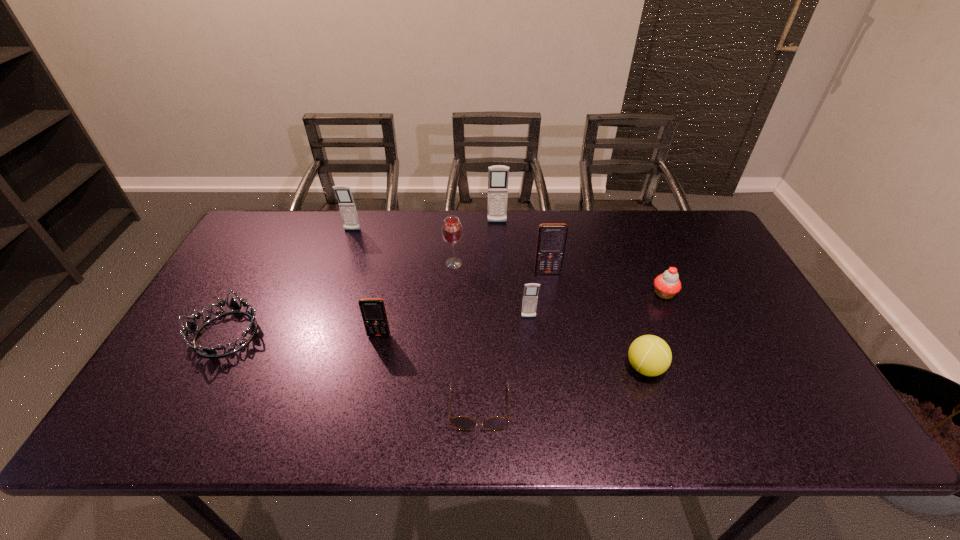
At what (x,y) coordinates should I click in order to perform the action: click on free space located 0.080m on the front-facing side of the second farthest object. Please return your answer as a coordinate pair (x, y). Looking at the image, I should click on (347, 248).

I want to click on free space located on the screen of the third nearest cellular telephone, so click(x=564, y=373).

Identify the location of vacant area situated 0.150m on the back of the red wineglass. The image size is (960, 540). (456, 228).

Find the location of a particular element. vacant space situated 0.190m on the screen of the nearest cellular telephone is located at coordinates (365, 403).

What are the coordinates of `vacant area located 0.240m on the front-facing side of the fourth cellular telephone from left to right` in the screenshot? It's located at (538, 399).

This screenshot has width=960, height=540. In order to click on vacant space located on the back of the fifth farthest object in this screenshot , I will do `click(651, 262)`.

Where is `vacant space situated on the back of the tennis ball`? vacant space situated on the back of the tennis ball is located at coordinates (609, 256).

Locate an element on the screen. This screenshot has height=540, width=960. free point located 0.090m on the front-facing side of the tiara is located at coordinates (192, 396).

Where is `object situated at the near edge`? object situated at the near edge is located at coordinates (460, 422).

This screenshot has height=540, width=960. I want to click on object that is positioned at the left edge, so click(193, 328).